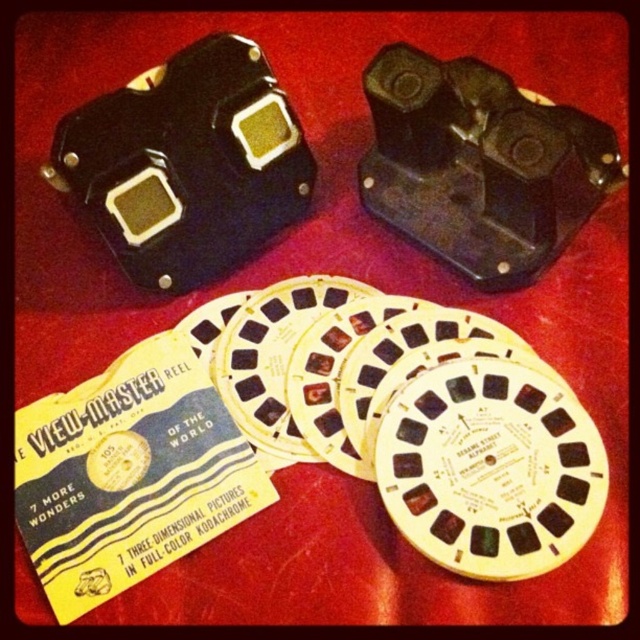
You are organizing a vintage photography exhibit and need to place the yellow paper card at upper left and the black plastic camera at upper center. Based on their positions in the image, which object is closer to the viewer?

The black plastic camera at upper center is closer to the viewer because the yellow paper card at upper left is positioned under it.

In the scene shown: You are organizing a vintage toy exhibition and need to place a yellow paper card at upper left on a display table. The table has a coordinate system where the bottom left corner is the origin point. The coordinates of the yellow paper card at upper left are given as point (129, 474). If the table is 1 meter wide and 1 meter tall, where should you place the yellow paper card at upper left in centimeters?

The yellow paper card at upper left should be placed at approximately 74.2 centimeters from the left edge and 20.2 centimeters from the bottom edge of the table since the coordinates are given as point (129, 474).